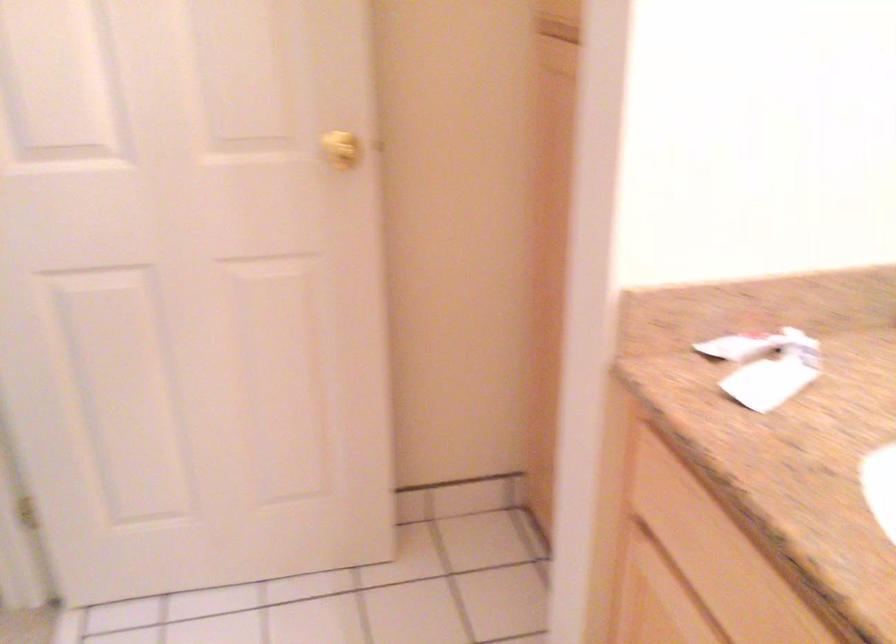
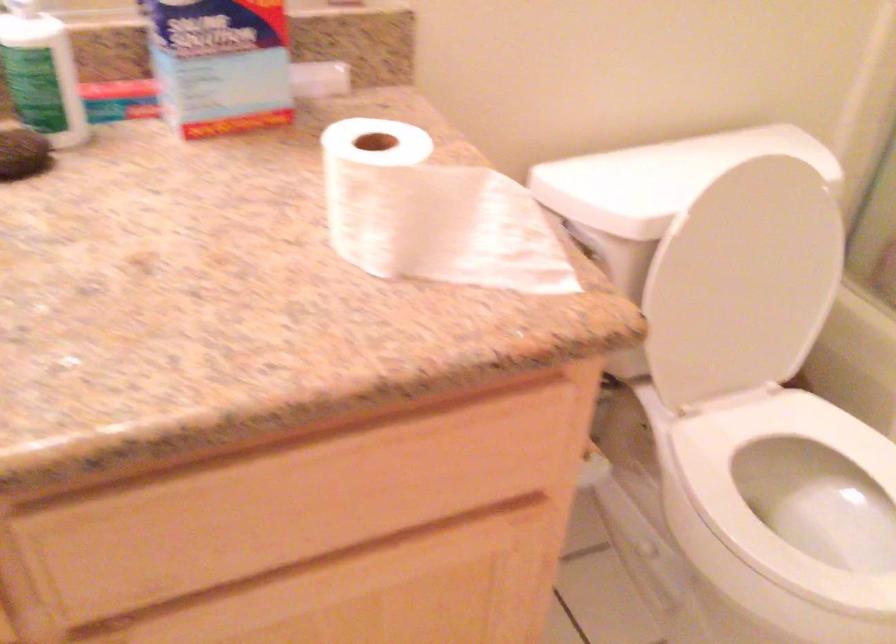
The images are taken continuously from a first-person perspective. In which direction is your viewpoint rotating?

The rotation direction of the camera is right-down.